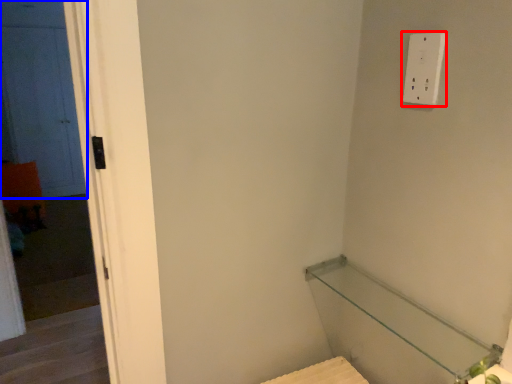
Question: Which of the following is the farthest to the observer, light switch (highlighted by a red box) or door (highlighted by a blue box)?

Choices:
 (A) light switch
 (B) door

Answer: (B)